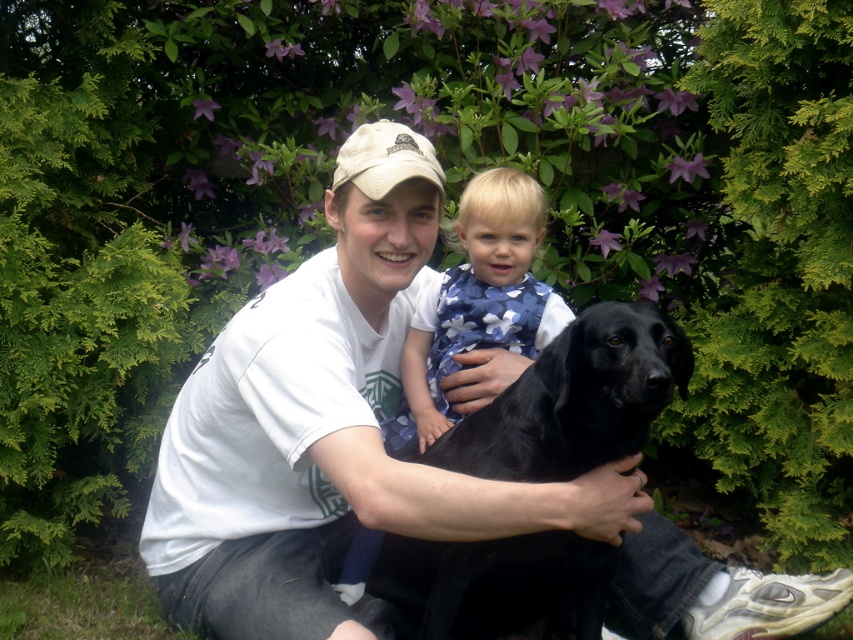
Between matte black dog at center and beige fabric cap at center, which one appears on the left side from the viewer's perspective?

From the viewer's perspective, matte black dog at center appears more on the left side.

Is point (206, 630) behind point (416, 144)?

Yes, it is behind point (416, 144).

Where is `matte black dog at center`? matte black dog at center is located at coordinates (370, 461).

Is shiny black dog at center below blue floral dress at center?

Yes, shiny black dog at center is below blue floral dress at center.

Measure the distance from shiny black dog at center to blue floral dress at center.

A distance of 17.60 inches exists between shiny black dog at center and blue floral dress at center.

You are a GUI agent. You are given a task and a screenshot of the screen. Output one action in this format:
    pyautogui.click(x=<x>, y=<y>)
    Task: Click on the shiny black dog at center
    
    Given the screenshot: What is the action you would take?
    pyautogui.click(x=575, y=400)

The height and width of the screenshot is (640, 853). In order to click on blue floral dress at center in this screenshot , I will do `click(477, 301)`.

Locate an element on the screen. The height and width of the screenshot is (640, 853). blue floral dress at center is located at coordinates (477, 301).